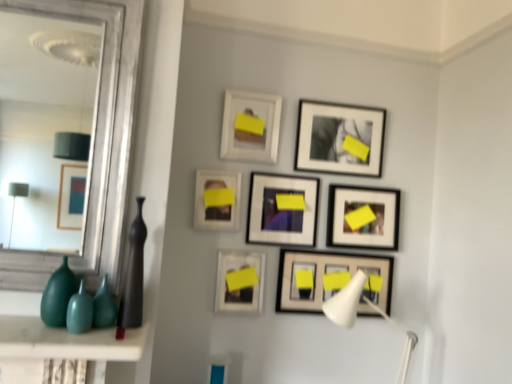
Question: Is point [71, 326] closer or farther from the camera than point [337, 268]?

Choices:
 (A) farther
 (B) closer

Answer: (B)

Question: In terms of height, does teal glossy vase at lower left, which is counted as the 1th vase, starting from the left, look taller or shorter compared to matte black picture frame at center, which is counted as the seventh picture frame, starting from the top?

Choices:
 (A) tall
 (B) short

Answer: (A)

Question: Estimate the real-world distances between objects in this image. Which object is closer to the teal glass vase at lower left, which is counted as the second glass vase, starting from the right?

Choices:
 (A) matte black vase at left, the 1th vase from the right
 (B) matte black picture frame at center right, the 4th picture frame when ordered from bottom to top
 (C) matte white picture frame at center, marked as the third picture frame in a bottom-to-top arrangement
 (D) matte black picture frame at center, which is counted as the seventh picture frame, starting from the top
 (E) white plastic table lamp at lower right

Answer: (A)

Question: Estimate the real-world distances between objects in this image. Which object is closer to the teal glass vase at lower left, which is counted as the second glass vase, starting from the right?

Choices:
 (A) matte white picture frame at center-left, the 6th picture frame from the bottom
 (B) teal glossy vase at lower left, the first vase positioned from the front
 (C) matte white picture frame at upper center, which is counted as the eighth picture frame, starting from the bottom
 (D) matte black vase at left, the 1th vase when ordered from back to front
 (E) green glass vase at lower left, placed as the 2th glass vase when sorted from left to right

Answer: (B)